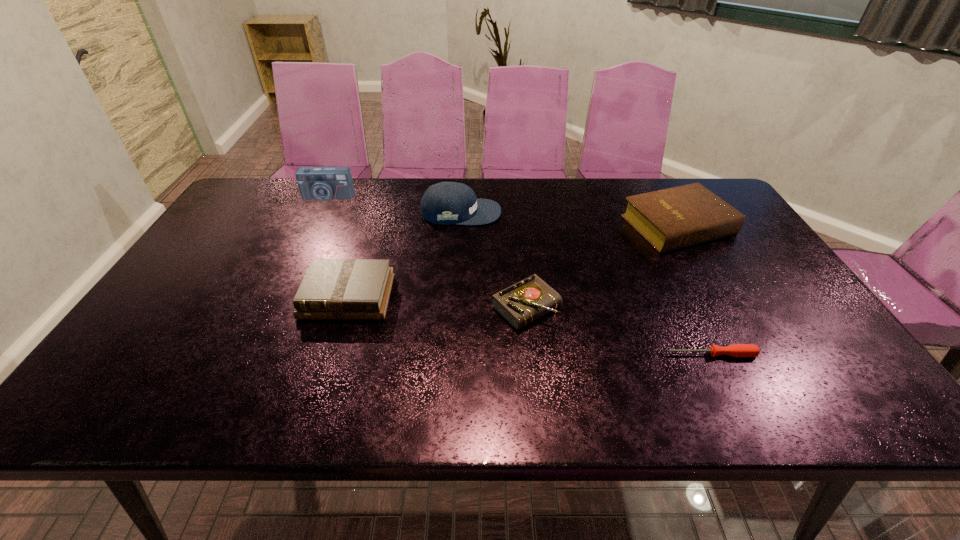
At what (x,y) coordinates should I click in order to perform the action: click on camera. Please return your answer as a coordinate pair (x, y). This screenshot has width=960, height=540. Looking at the image, I should click on (315, 183).

Locate an element on the screen. baseball cap is located at coordinates (445, 203).

This screenshot has height=540, width=960. I want to click on the right Bible, so click(673, 218).

This screenshot has width=960, height=540. I want to click on the nearer Bible, so click(339, 289).

This screenshot has height=540, width=960. Find the location of `the second shortest object`. the second shortest object is located at coordinates (524, 302).

Where is `the nearest object`? This screenshot has width=960, height=540. the nearest object is located at coordinates (735, 350).

The width and height of the screenshot is (960, 540). Find the location of `the shortest object`. the shortest object is located at coordinates (735, 350).

Identify the location of free region located 0.070m on the lens of the camera. (320, 214).

Where is `vacant space located on the front-facing side of the baseball cap`? This screenshot has width=960, height=540. vacant space located on the front-facing side of the baseball cap is located at coordinates 532,212.

This screenshot has height=540, width=960. What are the coordinates of `free location located 0.130m on the back of the right Bible` in the screenshot? It's located at (653, 180).